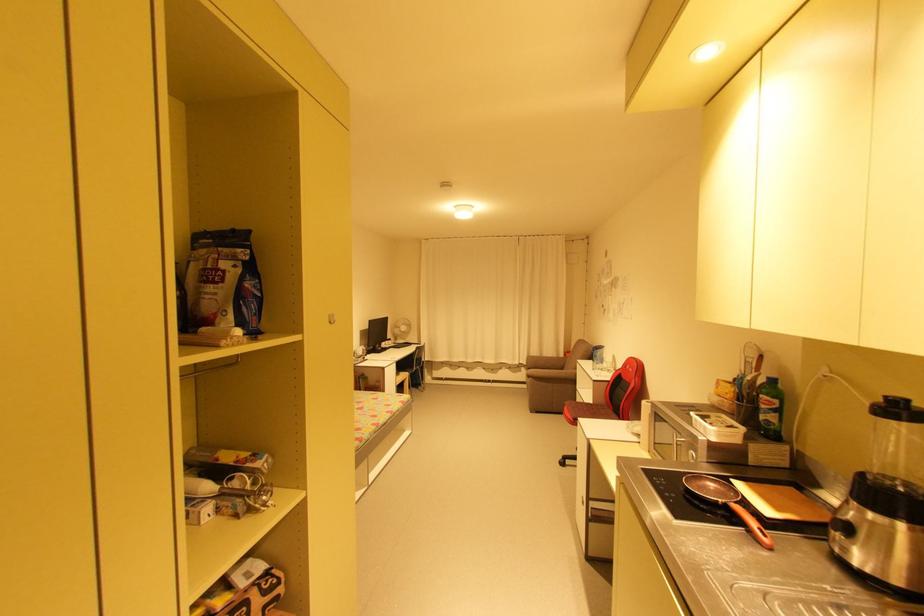
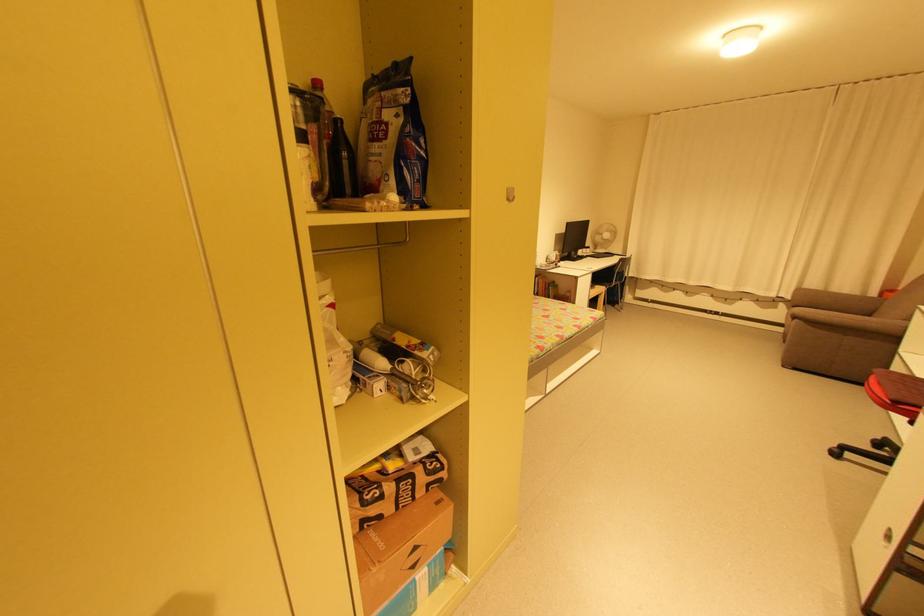
Locate, in the second image, the point that corresponds to the point at 529,363 in the first image.

(794, 297)